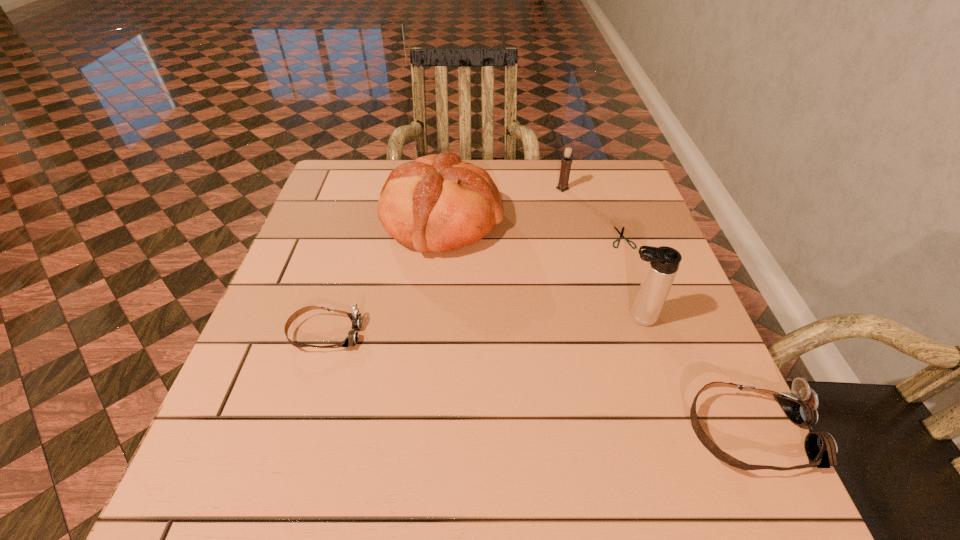
Locate an element on the screen. The height and width of the screenshot is (540, 960). the left goggles is located at coordinates (351, 340).

Identify the location of the shorter goggles. The height and width of the screenshot is (540, 960). (351, 340).

Locate an element on the screen. The width and height of the screenshot is (960, 540). the nearest object is located at coordinates (800, 406).

The image size is (960, 540). I want to click on the nearer goggles, so click(800, 406).

The height and width of the screenshot is (540, 960). What are the coordinates of `candle holder` in the screenshot? It's located at (566, 162).

This screenshot has width=960, height=540. Find the location of `the fourth object from right to left`. the fourth object from right to left is located at coordinates (566, 162).

Where is `bread`? bread is located at coordinates (437, 203).

Identify the location of shears. This screenshot has width=960, height=540. (621, 234).

Where is `thermos bottle`? thermos bottle is located at coordinates (663, 262).

Where is `vacant area situated 0.110m on the front-facing side of the left goggles`? vacant area situated 0.110m on the front-facing side of the left goggles is located at coordinates (415, 334).